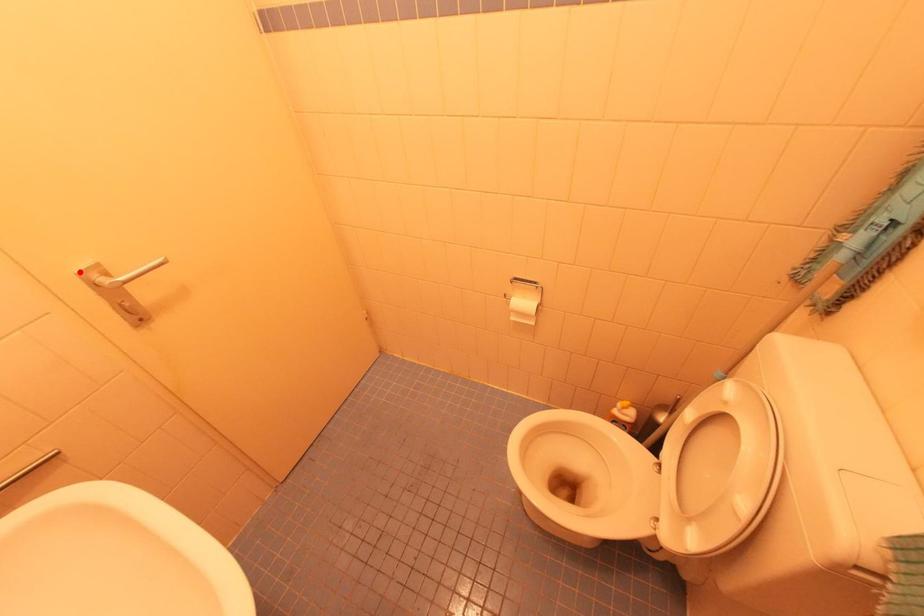
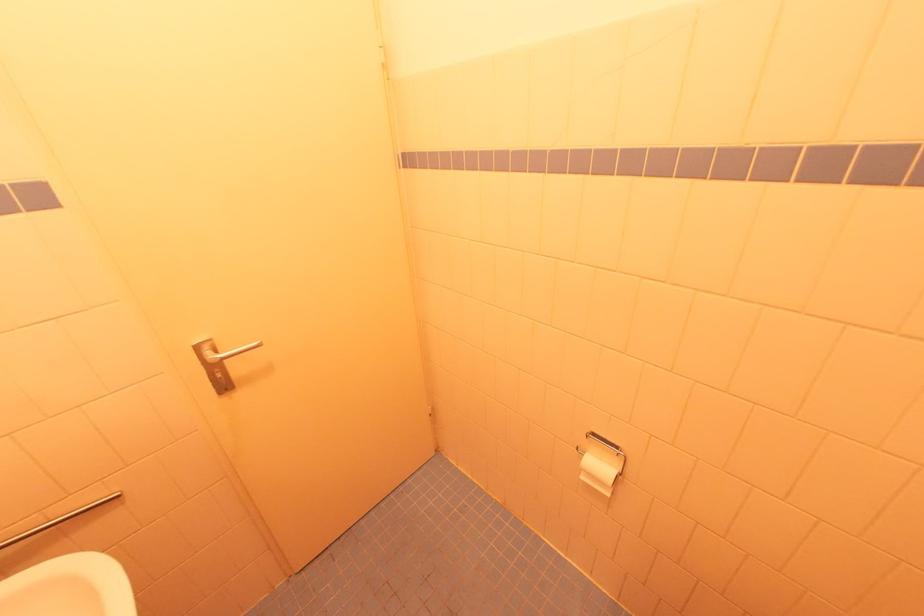
The point at the highlighted location is marked in the first image. Where is the corresponding point in the second image?

(197, 345)